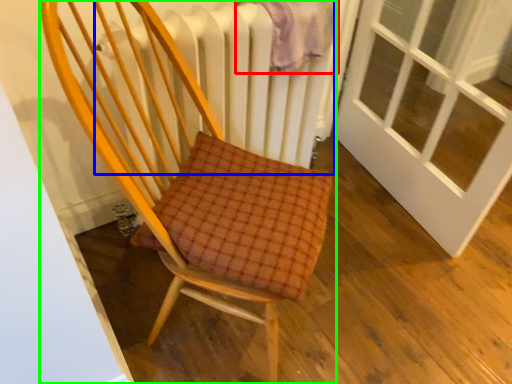
Question: Considering the real-world distances, which object is farthest from blanket (highlighted by a red box)? radiator (highlighted by a blue box) or chair (highlighted by a green box)?

Choices:
 (A) radiator
 (B) chair

Answer: (B)